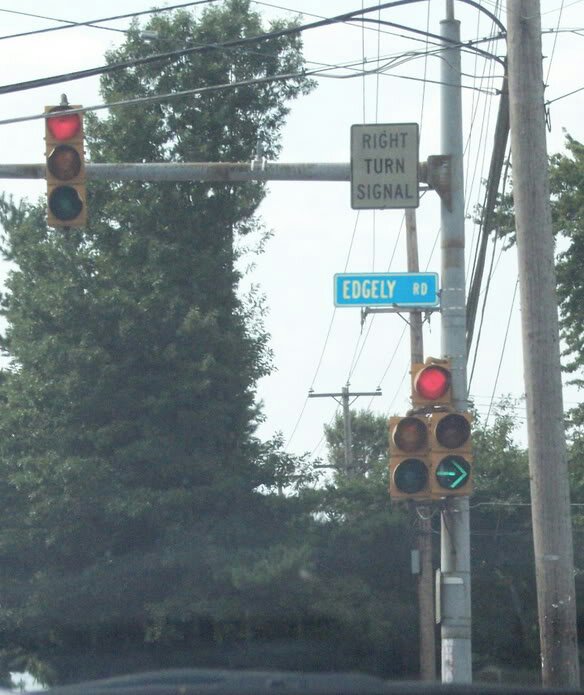
Locate an element on the screen. The image size is (584, 695). electrical wires is located at coordinates (346, 250), (352, 374), (384, 374), (496, 377), (472, 372), (484, 108), (363, 90), (79, 70).